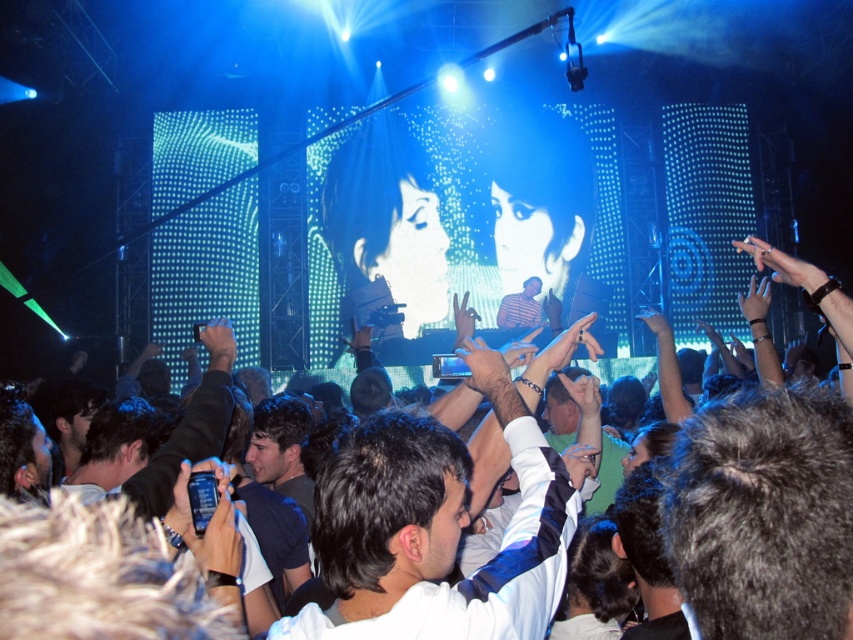
Question: Does white shirt at center appear on the left side of striped shirt at center?

Choices:
 (A) yes
 (B) no

Answer: (A)

Question: Among these points, which one is nearest to the camera?

Choices:
 (A) (514, 625)
 (B) (537, 276)

Answer: (A)

Question: Is white shirt at center bigger than striped shirt at center?

Choices:
 (A) no
 (B) yes

Answer: (B)

Question: Among these points, which one is farthest from the camera?

Choices:
 (A) [520, 326]
 (B) [521, 545]

Answer: (A)

Question: Can you confirm if white shirt at center is positioned above striped shirt at center?

Choices:
 (A) no
 (B) yes

Answer: (A)

Question: Which point is farther to the camera?

Choices:
 (A) striped shirt at center
 (B) white shirt at center

Answer: (A)